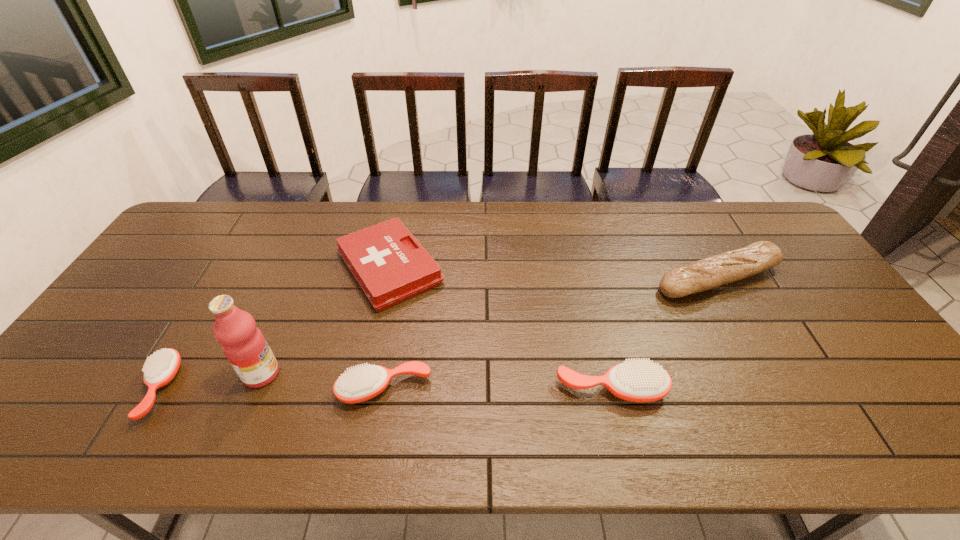
Select which object appears as the third closest to the second tallest hairbrush. Please provide its 2D coordinates. Your answer should be formatted as a tuple, i.e. [(x, y)], where the tuple contains the x and y coordinates of a point satisfying the conditions above.

[(640, 381)]

Locate an element on the screen. The width and height of the screenshot is (960, 540). object that stands as the closest to the second hairbrush from left to right is located at coordinates (244, 345).

Locate an element on the screen. The width and height of the screenshot is (960, 540). hairbrush that stands as the third closest to the rightmost object is located at coordinates (160, 369).

I want to click on the second closest hairbrush to the second tallest hairbrush, so click(x=160, y=369).

In order to click on vacant point that satisfies the following two spatial constraints: 1. on the label of the second object from left to right; 2. on the front side of the leftmost hairbrush in this screenshot , I will do `click(255, 388)`.

Find the location of `vacant space that satisfies the following two spatial constraints: 1. on the back side of the rightmost hairbrush; 2. on the label of the fifth object from right to left`. vacant space that satisfies the following two spatial constraints: 1. on the back side of the rightmost hairbrush; 2. on the label of the fifth object from right to left is located at coordinates (608, 374).

What are the coordinates of `vacant region that satisfies the following two spatial constraints: 1. on the front side of the fifth object from left to right; 2. on the right side of the shortest hairbrush` in the screenshot? It's located at (157, 389).

Locate an element on the screen. vacant space that satisfies the following two spatial constraints: 1. on the front side of the leftmost hairbrush; 2. on the left side of the second tallest hairbrush is located at coordinates (158, 389).

Where is `free spot that satisfies the following two spatial constraints: 1. on the front side of the first-aid kit; 2. on the label of the fruit juice`? The width and height of the screenshot is (960, 540). free spot that satisfies the following two spatial constraints: 1. on the front side of the first-aid kit; 2. on the label of the fruit juice is located at coordinates (367, 374).